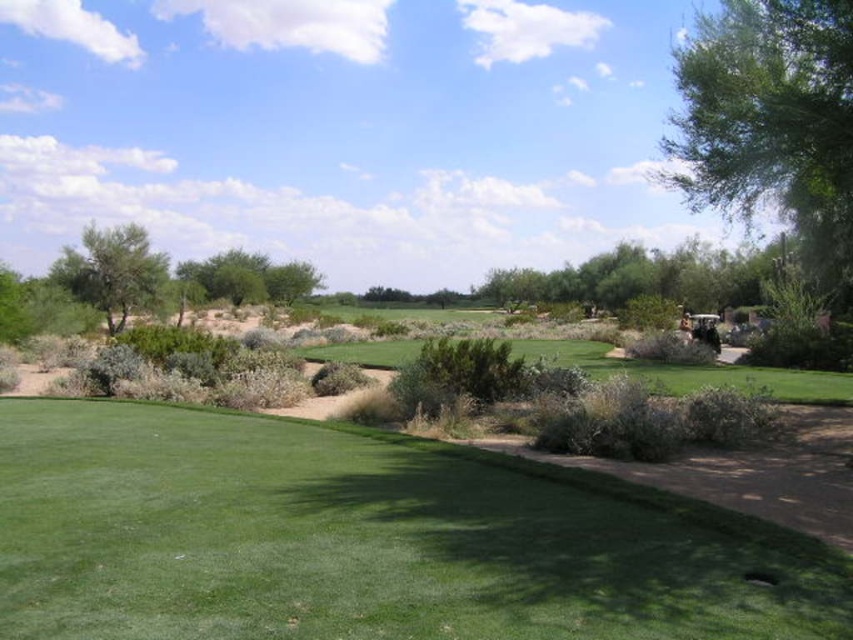
Question: Which object is the closest to the green leafy tree at left?

Choices:
 (A) green smooth hole at center
 (B) green leafy tree at center
 (C) green smooth grass at center

Answer: (C)

Question: Can you confirm if green leafy tree at upper right is positioned below green smooth hole at center?

Choices:
 (A) yes
 (B) no

Answer: (B)

Question: Can you confirm if green smooth grass at center is wider than green leafy tree at left?

Choices:
 (A) yes
 (B) no

Answer: (A)

Question: Which point is farther to the camera?

Choices:
 (A) (761, 579)
 (B) (157, 442)

Answer: (B)

Question: Estimate the real-world distances between objects in this image. Which object is closer to the green leafy tree at upper right?

Choices:
 (A) green leafy tree at left
 (B) green leafy tree at center
 (C) green smooth hole at center
 (D) green smooth grass at center

Answer: (D)

Question: Is green smooth grass at center positioned before green leafy tree at upper right?

Choices:
 (A) yes
 (B) no

Answer: (A)